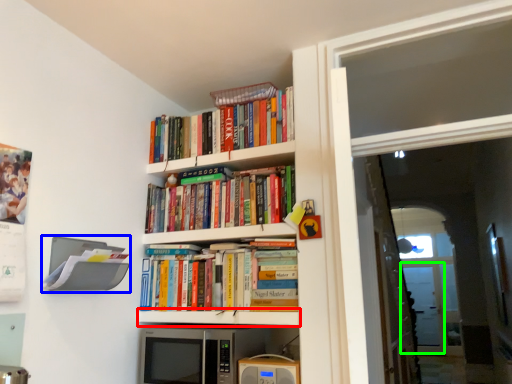
Question: Which is farther away from shelf (highlighted by a red box)? shelf (highlighted by a blue box) or screen door (highlighted by a green box)?

Choices:
 (A) shelf
 (B) screen door

Answer: (B)